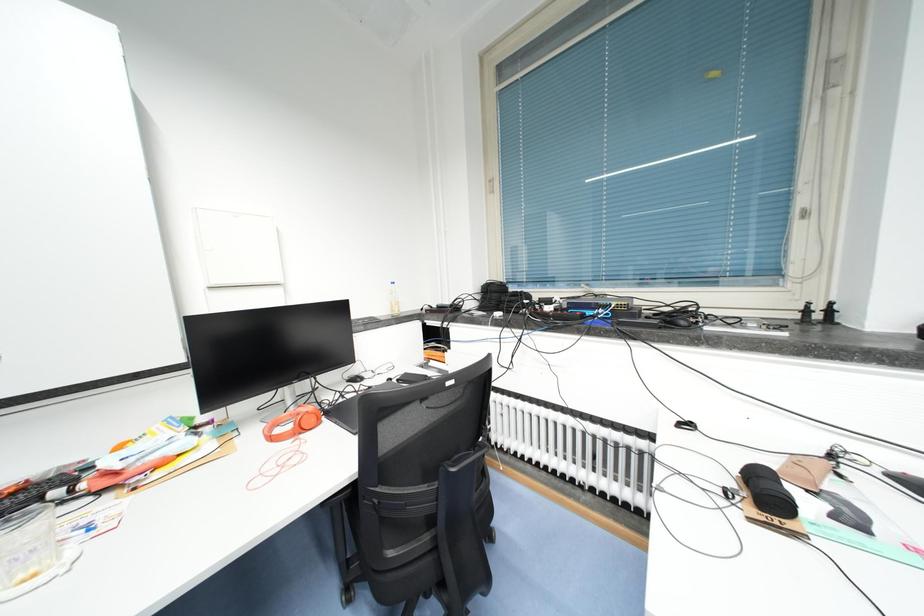
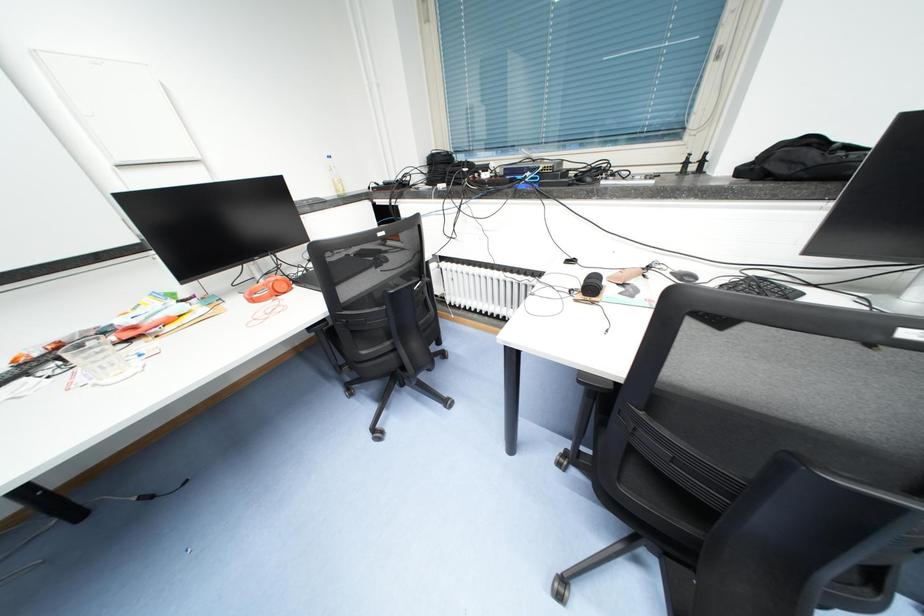
Question: The images are taken continuously from a first-person perspective. In which direction is your viewpoint rotating?

Choices:
 (A) Left
 (B) Right
 (C) Up
 (D) Down

Answer: (D)